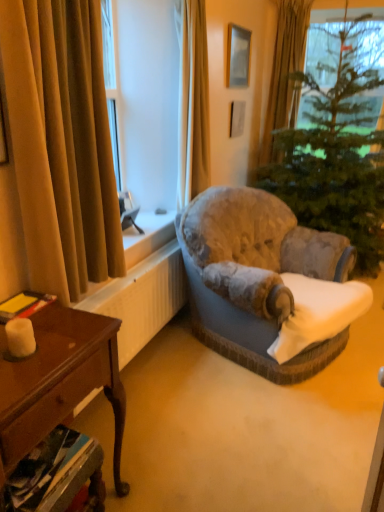
Find the location of a particular element. vacant point to the right of white matte candle at lower left is located at coordinates (62, 350).